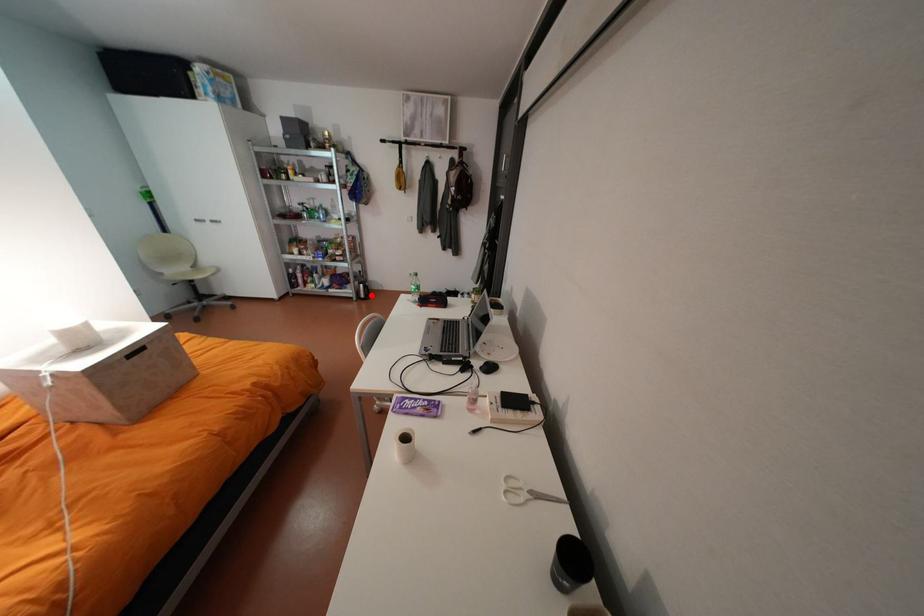
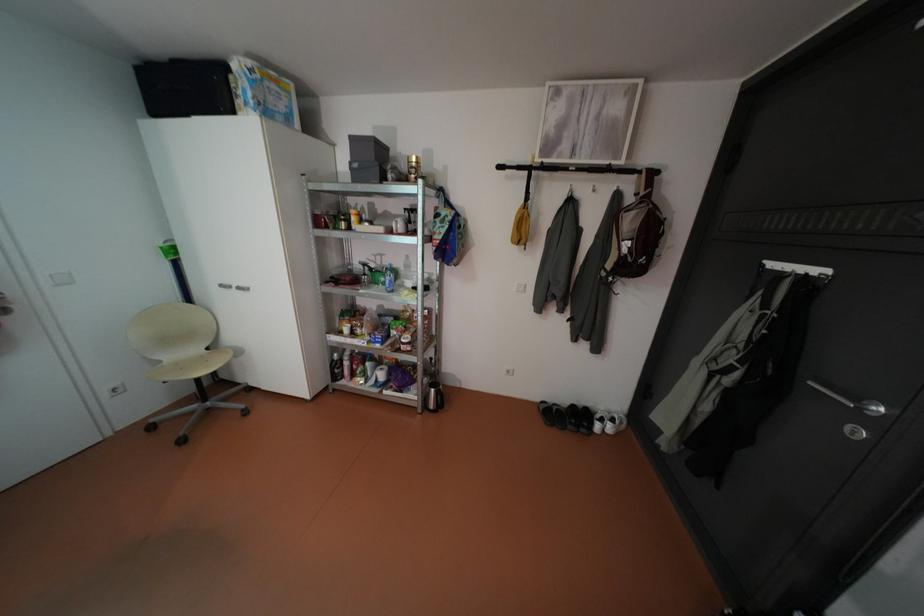
Question: I am providing you with two images of the same scene from different viewpoints. In image1, a red point is highlighted. Considering the same 3D point in image2, which of the following is correct?

Choices:
 (A) It is closer
 (B) It is farther

Answer: (A)